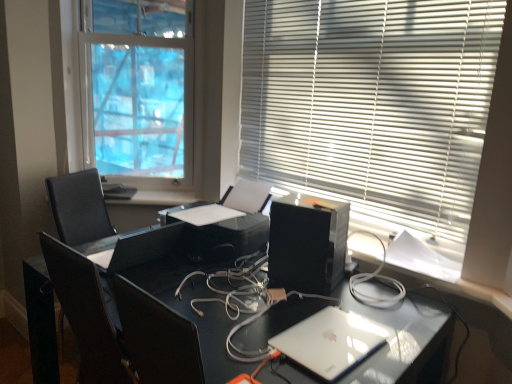
This screenshot has height=384, width=512. I want to click on free space that is to the left of satin white laptop at lower right, so [x=245, y=330].